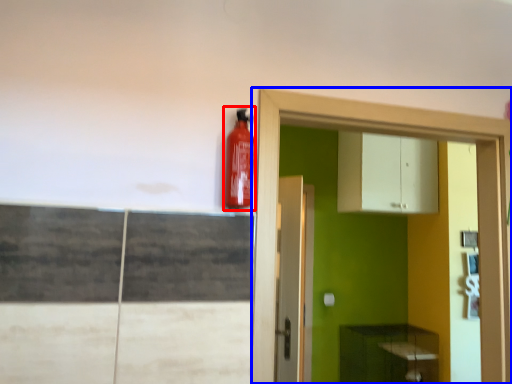
Question: Among these objects, which one is farthest to the camera, extinguisher (highlighted by a red box) or dresser (highlighted by a blue box)?

Choices:
 (A) extinguisher
 (B) dresser

Answer: (B)